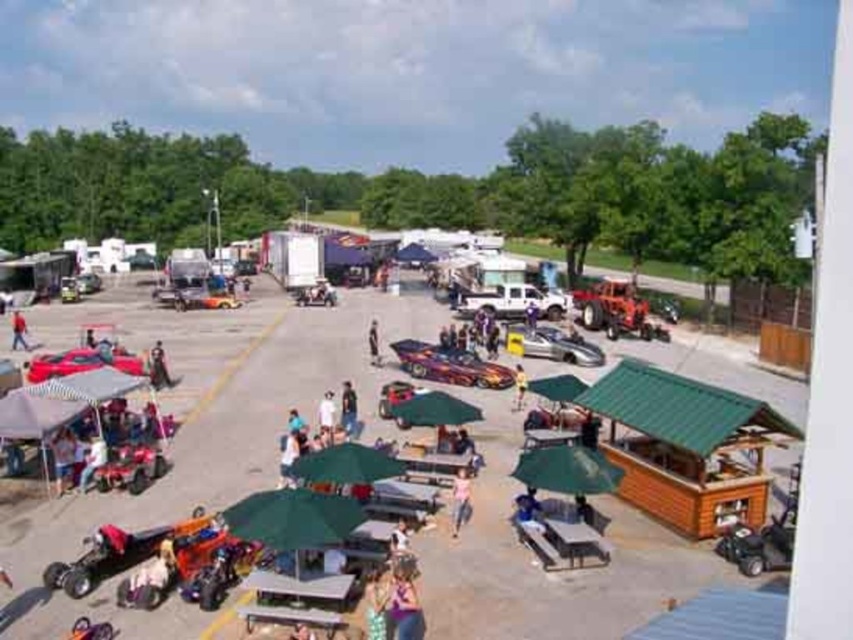
Question: Which of the following is the farthest from the observer?

Choices:
 (A) white matte truck at center
 (B) yellow fabric umbrella at center

Answer: (A)

Question: Where is shiny metallic car at center located in relation to shiny red car at lower left in the image?

Choices:
 (A) right
 (B) left

Answer: (A)

Question: Among these objects, which one is farthest from the camera?

Choices:
 (A) shiny metallic car at center
 (B) shiny red car at lower left
 (C) white fabric umbrella at center

Answer: (A)

Question: Does green fabric umbrella at center have a larger size compared to white fabric umbrella at center?

Choices:
 (A) yes
 (B) no

Answer: (A)

Question: Which object is the closest to the shiny metallic car at center?

Choices:
 (A) white fabric umbrella at center
 (B) silver metallic car at center
 (C) metallic gold car at center-left

Answer: (B)

Question: Considering the relative positions of shiny metallic car at center and silver metallic car at center in the image provided, where is shiny metallic car at center located with respect to silver metallic car at center?

Choices:
 (A) below
 (B) above

Answer: (A)